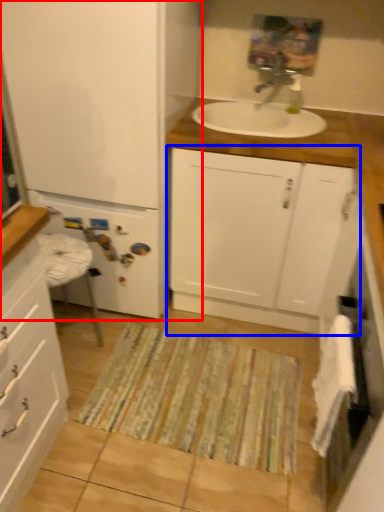
Question: Among these objects, which one is farthest to the camera, bathroom cabinet (highlighted by a red box) or bathroom cabinet (highlighted by a blue box)?

Choices:
 (A) bathroom cabinet
 (B) bathroom cabinet

Answer: (B)